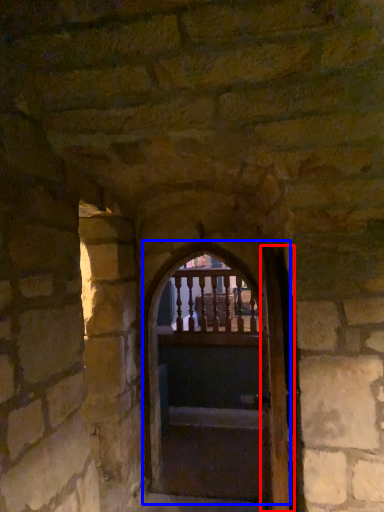
Question: Which of the following is the farthest to the observer, door (highlighted by a red box) or door (highlighted by a blue box)?

Choices:
 (A) door
 (B) door

Answer: (B)